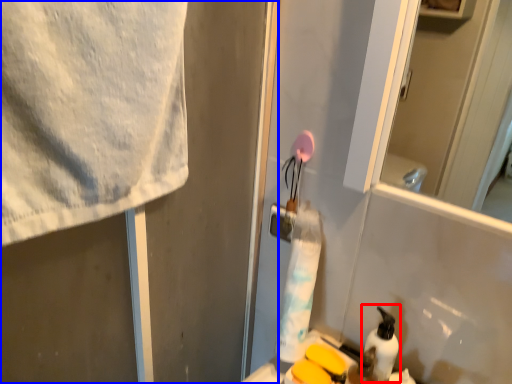
Question: Which of the following is the closest to the observer, cleaning product (highlighted by a red box) or screen door (highlighted by a blue box)?

Choices:
 (A) cleaning product
 (B) screen door

Answer: (B)